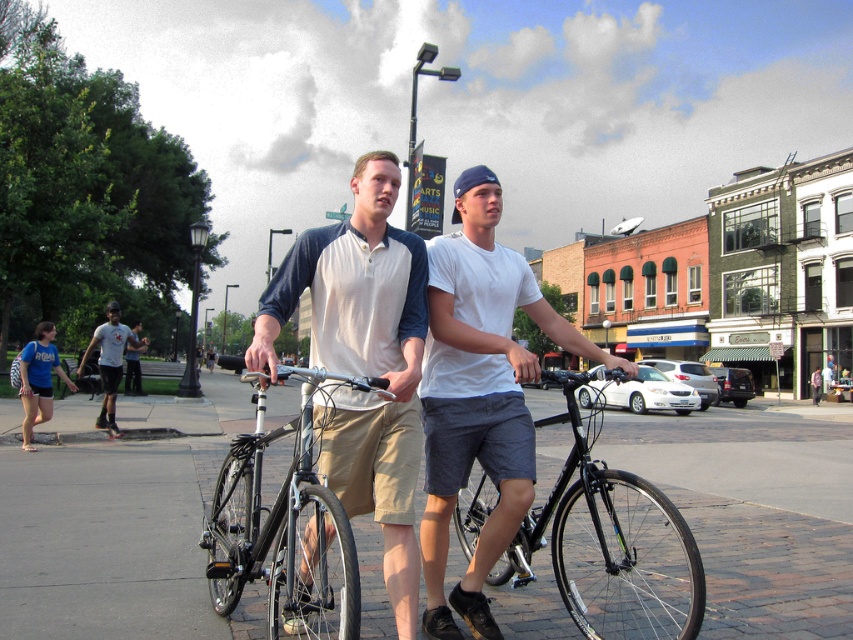
Does black matte bicycle at center have a greater height compared to white t-shirt at center?

In fact, black matte bicycle at center may be shorter than white t-shirt at center.

Can you confirm if black matte bicycle at center is positioned above white t-shirt at center?

Incorrect, black matte bicycle at center is not positioned above white t-shirt at center.

Which is behind, point (683, 611) or point (119, 328)?

The point (119, 328) is behind.

The width and height of the screenshot is (853, 640). What are the coordinates of `black matte bicycle at center` in the screenshot? It's located at (610, 544).

Is point (372, 403) positioned behind point (569, 508)?

No, (372, 403) is in front of (569, 508).

How far apart are matte white shirt at center and black matte bicycle at center?

matte white shirt at center and black matte bicycle at center are 7.46 feet apart from each other.

Where is `matte white shirt at center`? This screenshot has width=853, height=640. matte white shirt at center is located at coordinates (363, 360).

Is white matte bicycle at center taller than black matte bicycle at center?

Correct, white matte bicycle at center is much taller as black matte bicycle at center.

Between white matte bicycle at center and black matte bicycle at center, which one is positioned lower?

Positioned lower is black matte bicycle at center.

Where is `white matte bicycle at center`? This screenshot has width=853, height=640. white matte bicycle at center is located at coordinates (479, 394).